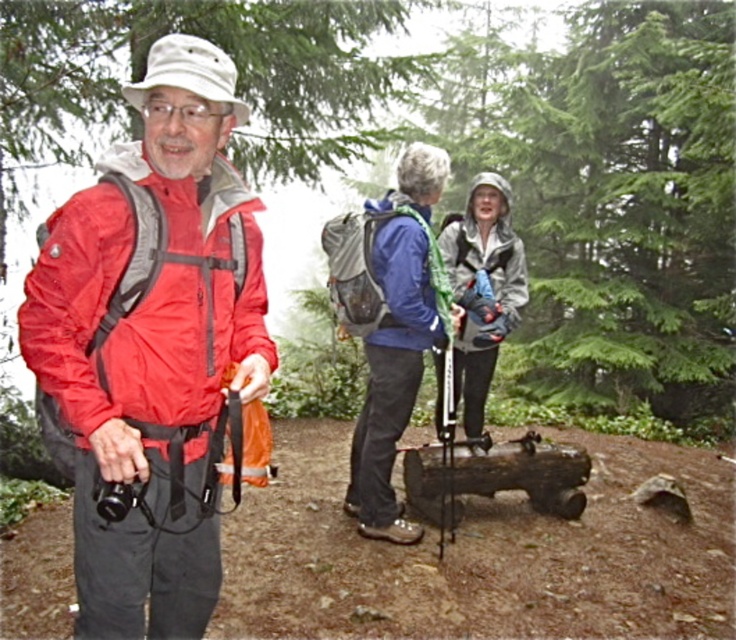
Is blue matte jacket at center behind matte gray jacket at center?

That is False.

Does point (392, 248) lie behind point (470, 426)?

No, it is in front of (470, 426).

Does point (328, 248) lie in front of point (509, 285)?

That is True.

This screenshot has width=736, height=640. Find the location of `blue matte jacket at center`. blue matte jacket at center is located at coordinates (382, 269).

Can you confirm if matte nylon jacket at left is taller than matte gray jacket at center?

In fact, matte nylon jacket at left may be shorter than matte gray jacket at center.

Is point (57, 332) positioned behind point (470, 435)?

No, (57, 332) is in front of (470, 435).

This screenshot has height=640, width=736. I want to click on matte nylon jacket at left, so click(x=145, y=298).

Consider the image. Can you confirm if matte nylon jacket at left is positioned to the right of blue fabric jacket at center?

Incorrect, matte nylon jacket at left is not on the right side of blue fabric jacket at center.

What do you see at coordinates (145, 298) in the screenshot?
I see `matte nylon jacket at left` at bounding box center [145, 298].

This screenshot has width=736, height=640. I want to click on matte nylon jacket at left, so click(x=145, y=298).